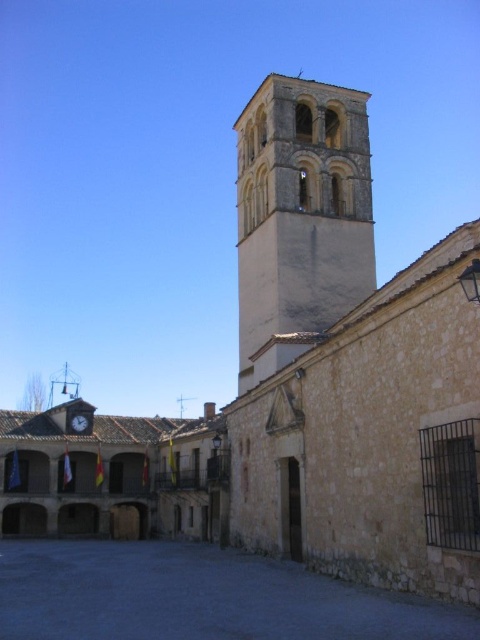
You are standing in the historic town square and want to place a small statue between the two points, point (78, 563) and point (81, 417). Which point should the statue be closer to in order to appear larger from your current position?

The statue should be placed closer to point (78, 563) because it is closer to the viewer, making the statue appear larger from your current position.

You are standing in the town square and want to find the entrance to the dark stone alley at lower left. Based on the scene, where should you look relative to the white stone tower at center?

The dark stone alley at lower left is located below the white stone tower at center, so you should look downward or towards the lower area near the base of the tower to find its entrance.

You are standing in the town square and want to find the dark stone alley at lower left. According to the scene, where should you look relative to the metallic clock at center?

The dark stone alley at lower left is located to the right of the metallic clock at center.